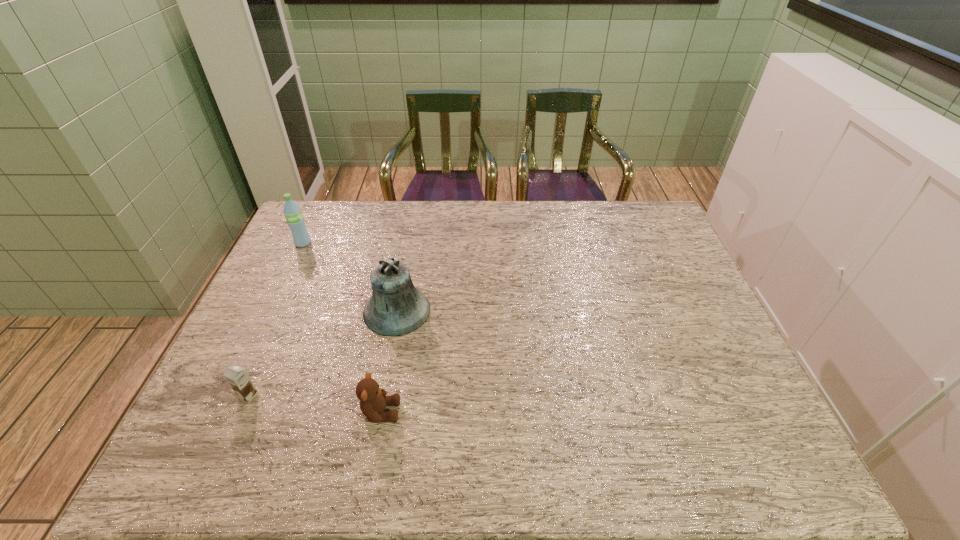
You are a GUI agent. You are given a task and a screenshot of the screen. Output one action in this format:
    pyautogui.click(x=<x>, y=<y>)
    Task: Click on the chocolate milk at the left edge
    
    Given the screenshot: What is the action you would take?
    pyautogui.click(x=237, y=378)

Find the location of `object that is positioned at the far left corner`. object that is positioned at the far left corner is located at coordinates (295, 220).

Where is `blank space at the far edge of the desktop`? This screenshot has height=540, width=960. blank space at the far edge of the desktop is located at coordinates (391, 204).

At what (x,y) coordinates should I click in order to perform the action: click on blank area at the near edge. Please return your answer as a coordinate pair (x, y). The height and width of the screenshot is (540, 960). Looking at the image, I should click on (294, 449).

You are a GUI agent. You are given a task and a screenshot of the screen. Output one action in this format:
    pyautogui.click(x=<x>, y=<y>)
    Task: Click on the free location at the left edge of the desktop
    The width and height of the screenshot is (960, 540).
    Given the screenshot: What is the action you would take?
    pyautogui.click(x=293, y=301)

In the image, there is a desktop. What are the coordinates of `vacant space at the right edge` in the screenshot? It's located at (678, 275).

Find the location of `free region at the far left corner of the desktop`. free region at the far left corner of the desktop is located at coordinates (307, 201).

Where is `vacant space at the far right corner of the desktop`? Image resolution: width=960 pixels, height=540 pixels. vacant space at the far right corner of the desktop is located at coordinates (653, 220).

Where is `vacant space in between the teddy bear and the farthest object`? The height and width of the screenshot is (540, 960). vacant space in between the teddy bear and the farthest object is located at coordinates (342, 328).

Identify the location of blank region between the second farthest object and the chocolate milk. (323, 353).